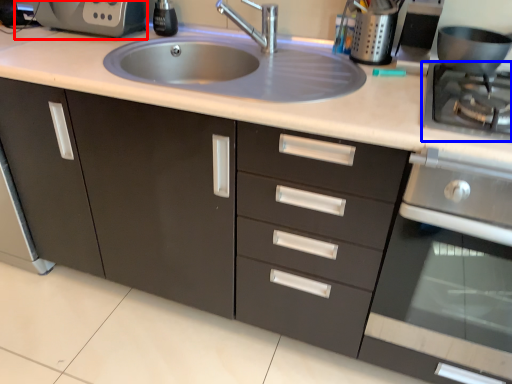
Question: Which point is further to the camera, coffee machine (highlighted by a red box) or gas stove (highlighted by a blue box)?

Choices:
 (A) coffee machine
 (B) gas stove

Answer: (A)